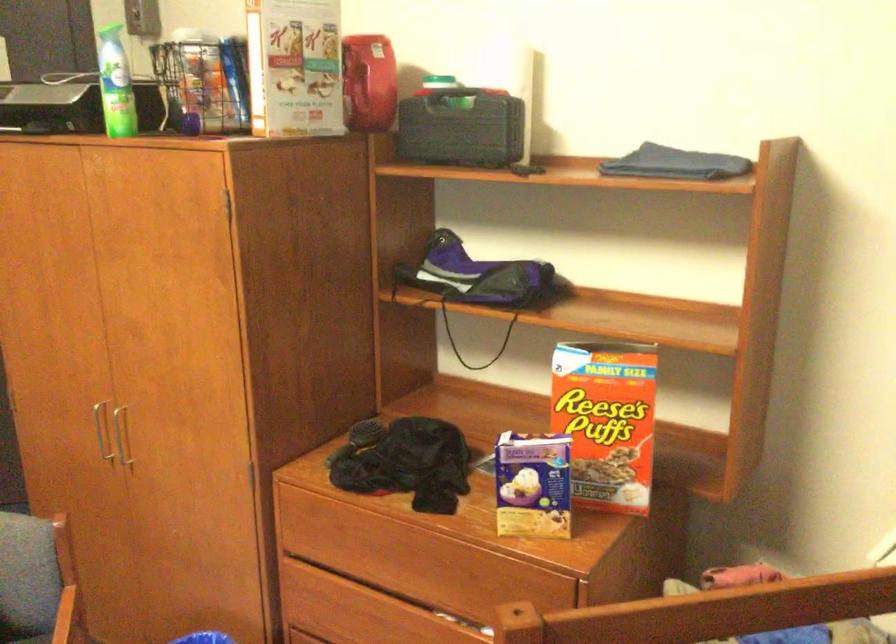
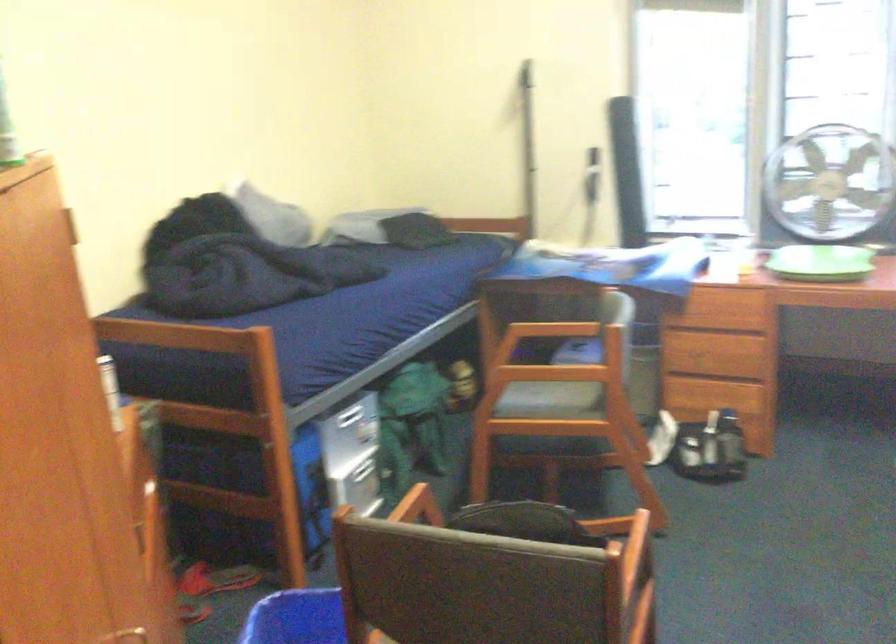
Question: I am providing you with two images of the same scene from different viewpoints. Please identify which objects are invisible in image2.

Choices:
 (A) green circular tray
 (B) chrome flush button
 (C) blue plastic bin
 (D) drawer cutout handle

Answer: (D)